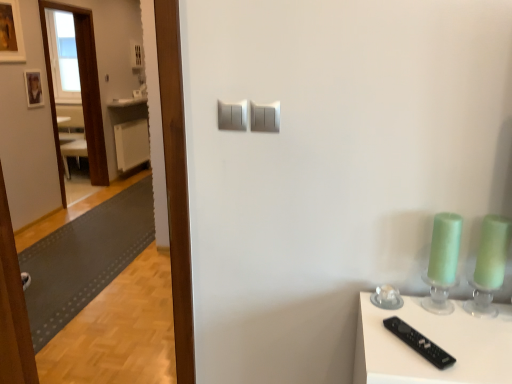
Where is `black plastic remote at lower right`? The height and width of the screenshot is (384, 512). black plastic remote at lower right is located at coordinates (419, 343).

Locate an element on the screen. white plastic radiator at left is located at coordinates (131, 144).

How much space does wooden photo frame at upper left, which is counted as the second picture frame, starting from the top, occupy vertically?

The height of wooden photo frame at upper left, which is counted as the second picture frame, starting from the top, is 13.41 inches.

Image resolution: width=512 pixels, height=384 pixels. I want to click on wooden photo frame at upper left, which ranks as the 2th picture frame in front-to-back order, so click(x=34, y=88).

The height and width of the screenshot is (384, 512). What do you see at coordinates (436, 288) in the screenshot?
I see `green glass candle holder at right` at bounding box center [436, 288].

In order to face green glass candle holder at right, should I rotate leftwards or rightwards?

Turn right approximately 24.001 degrees to face it.

What do you see at coordinates (11, 33) in the screenshot?
I see `wooden picture frame at upper left, marked as the second picture frame in a bottom-to-top arrangement` at bounding box center [11, 33].

At what (x,y) coordinates should I click in order to perform the action: click on gray rubber mat at left. Please return your answer as a coordinate pair (x, y). Looking at the image, I should click on (85, 258).

Where is `black plastic remote at lower right`? The height and width of the screenshot is (384, 512). black plastic remote at lower right is located at coordinates (419, 343).

Based on the photo, which of these two, transparent wooden door at left or white plastic radiator at left, is smaller?

white plastic radiator at left.

Is the depth of transparent wooden door at left greater than that of white plastic radiator at left?

No.

From a real-world perspective, which object stands above the other?

transparent wooden door at left is physically above.

Looking at this image, does transparent wooden door at left turn towards white plastic radiator at left?

No, transparent wooden door at left is not turned towards white plastic radiator at left.

Is white glossy counter top at upper left not close to satin silver switch at center, which is the second light switch from left to right?

Indeed, white glossy counter top at upper left is not near satin silver switch at center, which is the second light switch from left to right.

Who is taller, white glossy counter top at upper left or satin silver switch at center, which is the second light switch from left to right?

With more height is satin silver switch at center, which is the second light switch from left to right.

Does satin silver light switch at upper center, the 1th light switch from the left, have a lesser width compared to wooden photo frame at upper left, the first picture frame ordered from the bottom?

Indeed, satin silver light switch at upper center, the 1th light switch from the left, has a lesser width compared to wooden photo frame at upper left, the first picture frame ordered from the bottom.

From a real-world perspective, is satin silver light switch at upper center, the 1th light switch from the left, positioned above or below wooden photo frame at upper left, which ranks as the 2th picture frame in front-to-back order?

In terms of real-world spatial position, satin silver light switch at upper center, the 1th light switch from the left, is above wooden photo frame at upper left, which ranks as the 2th picture frame in front-to-back order.

Considering the relative positions of satin silver light switch at upper center, the 1th light switch from the left, and wooden photo frame at upper left, which ranks as the 2th picture frame in front-to-back order, in the image provided, is satin silver light switch at upper center, the 1th light switch from the left, to the left of wooden photo frame at upper left, which ranks as the 2th picture frame in front-to-back order, from the viewer's perspective?

No.

Based on the photo, can we say satin silver light switch at upper center, the 1th light switch from the left, lies outside wooden photo frame at upper left, which is counted as the second picture frame, starting from the top?

Yes.

Based on their sizes in the image, would you say gray rubber mat at left is bigger or smaller than satin silver switch at center, the 1th light switch positioned from the right?

gray rubber mat at left is bigger than satin silver switch at center, the 1th light switch positioned from the right.

In the scene shown: How distant is gray rubber mat at left from satin silver switch at center, which is the second light switch from left to right?

9.33 feet.

From the image's perspective, which one is positioned higher, gray rubber mat at left or satin silver switch at center, which is the second light switch from left to right?

satin silver switch at center, which is the second light switch from left to right, from the image's perspective.

Is gray rubber mat at left wider than satin silver switch at center, which is the second light switch from left to right?

Correct, the width of gray rubber mat at left exceeds that of satin silver switch at center, which is the second light switch from left to right.

Considering the sizes of satin silver switch at center, the 1th light switch positioned from the right, and satin silver light switch at upper center, which is the second light switch in right-to-left order, in the image, is satin silver switch at center, the 1th light switch positioned from the right, taller or shorter than satin silver light switch at upper center, which is the second light switch in right-to-left order,?

satin silver switch at center, the 1th light switch positioned from the right, is shorter than satin silver light switch at upper center, which is the second light switch in right-to-left order.

Considering the positions of points (264, 105) and (232, 113), is point (264, 105) farther from camera compared to point (232, 113)?

No, it is not.

Considering the sizes of satin silver switch at center, which is the second light switch from left to right, and satin silver light switch at upper center, the 1th light switch from the left, in the image, is satin silver switch at center, which is the second light switch from left to right, wider or thinner than satin silver light switch at upper center, the 1th light switch from the left,?

Considering their sizes, satin silver switch at center, which is the second light switch from left to right, looks broader than satin silver light switch at upper center, the 1th light switch from the left.

How different are the orientations of gray rubber mat at left and white plastic radiator at left in degrees?

The angle between the facing direction of gray rubber mat at left and the facing direction of white plastic radiator at left is 90 degrees.

From their relative heights in the image, would you say gray rubber mat at left is taller or shorter than white plastic radiator at left?

Considering their sizes, gray rubber mat at left has less height than white plastic radiator at left.

Considering the relative positions of gray rubber mat at left and white plastic radiator at left in the image provided, is gray rubber mat at left to the left of white plastic radiator at left from the viewer's perspective?

No.

In the scene shown: Is gray rubber mat at left not close to white glossy counter top at upper left?

gray rubber mat at left is positioned a significant distance from white glossy counter top at upper left.

Can you confirm if gray rubber mat at left is shorter than white glossy counter top at upper left?

Indeed, gray rubber mat at left has a lesser height compared to white glossy counter top at upper left.

Considering the positions of point (91, 287) and point (136, 99), is point (91, 287) closer or farther from the camera than point (136, 99)?

Point (91, 287) is closer to the camera than point (136, 99).

Is gray rubber mat at left bigger or smaller than white glossy counter top at upper left?

gray rubber mat at left is bigger than white glossy counter top at upper left.

At what (x,y) coordinates should I click in order to perform the action: click on radiator on the right of the transparent wooden door at left. Please return your answer as a coordinate pair (x, y). Image resolution: width=512 pixels, height=384 pixels. Looking at the image, I should click on (131, 144).

Image resolution: width=512 pixels, height=384 pixels. I want to click on counter top above the satin silver switch at center, which is the second light switch from left to right (from the image's perspective), so click(127, 102).

In the scene shown: Considering their positions, is white plastic radiator at left positioned closer to wooden picture frame at upper left, which is counted as the 1th picture frame, starting from the top, than wooden photo frame at upper left, the first picture frame when ordered from back to front?

Based on the image, wooden photo frame at upper left, the first picture frame when ordered from back to front, appears to be nearer to wooden picture frame at upper left, which is counted as the 1th picture frame, starting from the top.

Estimate the real-world distances between objects in this image. Which object is closer to black plastic remote at lower right, white glossy counter top at upper left or transparent wooden door at left?

Based on the image, transparent wooden door at left appears to be nearer to black plastic remote at lower right.

Based on their spatial positions, is gray rubber mat at left or transparent wooden door at left closer to black plastic remote at lower right?

gray rubber mat at left lies closer to black plastic remote at lower right than the other object.

Based on their spatial positions, is transparent wooden door at left or green glass candle holder at right further from wooden photo frame at upper left, the first picture frame when ordered from back to front?

Among the two, green glass candle holder at right is located further to wooden photo frame at upper left, the first picture frame when ordered from back to front.

From the image, which object appears to be farther from wooden photo frame at upper left, which is counted as the second picture frame, starting from the top, white plastic radiator at left or satin silver switch at center, which is the second light switch from left to right?

satin silver switch at center, which is the second light switch from left to right, is further to wooden photo frame at upper left, which is counted as the second picture frame, starting from the top.

In the scene shown: Based on their spatial positions, is gray rubber mat at left or satin silver switch at center, which is the second light switch from left to right, closer to wooden picture frame at upper left, the 1th picture frame when ordered from front to back?

gray rubber mat at left lies closer to wooden picture frame at upper left, the 1th picture frame when ordered from front to back, than the other object.

When comparing their distances from gray rubber mat at left, does transparent wooden door at left or white plastic radiator at left seem closer?

transparent wooden door at left lies closer to gray rubber mat at left than the other object.

Considering their positions, is white glossy counter top at upper left positioned further to white plastic radiator at left than wooden photo frame at upper left, the first picture frame ordered from the bottom?

The object further to white plastic radiator at left is wooden photo frame at upper left, the first picture frame ordered from the bottom.

What are the coordinates of `candle holder between black plastic remote at lower right and white plastic radiator at left in the front-back direction` in the screenshot? It's located at (436, 288).

Identify the location of counter top between green glass candle holder at right and white plastic radiator at left in the front-back direction. (127, 102).

Find the location of `glass door between wooden photo frame at upper left, the first picture frame ordered from the bottom, and white plastic radiator at left, along the z-axis`. glass door between wooden photo frame at upper left, the first picture frame ordered from the bottom, and white plastic radiator at left, along the z-axis is located at coordinates (81, 92).

Locate an element on the screen. glass door positioned between gray rubber mat at left and white plastic radiator at left from near to far is located at coordinates (81, 92).